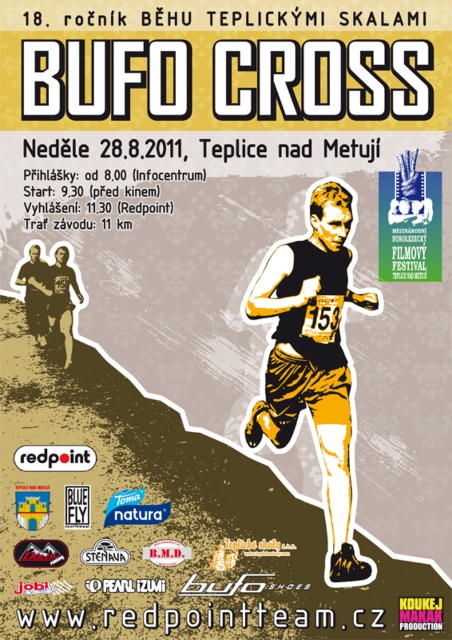
Can you confirm if yellow textured shorts at lower left is thinner than matte black running suit at lower left?

No.

Can you confirm if yellow textured shorts at lower left is positioned above matte black running suit at lower left?

Actually, yellow textured shorts at lower left is below matte black running suit at lower left.

Which is in front, point (48, 305) or point (46, 316)?

Point (48, 305) is in front.

Where is `yellow textured shorts at lower left`? yellow textured shorts at lower left is located at coordinates tap(60, 296).

Which is behind, point (312, 212) or point (31, 310)?

The point (31, 310) is more distant.

Is yellow textured shorts at center shorter than matte black running suit at lower left?

No, yellow textured shorts at center is not shorter than matte black running suit at lower left.

Measure the distance between yellow textured shorts at center and camera.

A distance of 8.92 meters exists between yellow textured shorts at center and camera.

Locate an element on the screen. yellow textured shorts at center is located at coordinates (312, 355).

Consider the image. Does yellow textured shorts at center appear on the right side of yellow textured shorts at lower left?

Indeed, yellow textured shorts at center is positioned on the right side of yellow textured shorts at lower left.

Between point (323, 252) and point (50, 269), which one is positioned in front?

Point (323, 252) is in front.

What are the coordinates of `yellow textured shorts at center` in the screenshot? It's located at (312, 355).

This screenshot has width=452, height=640. I want to click on yellow textured shorts at center, so click(312, 355).